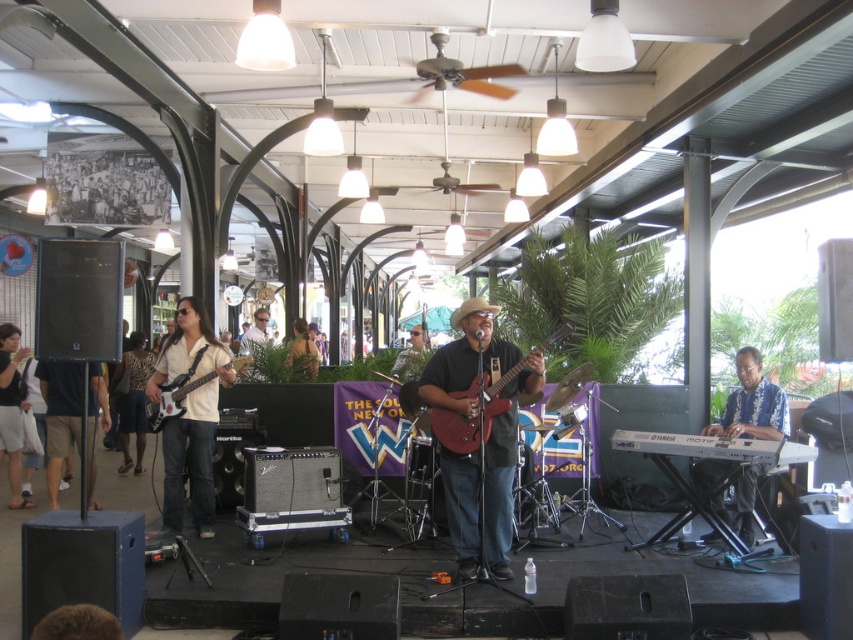
Question: Is hawaiian shirt at right wider than matte red electric guitar at center?

Choices:
 (A) yes
 (B) no

Answer: (B)

Question: Which of the following is the farthest from the observer?

Choices:
 (A) matte white shirt at left
 (B) matte red guitar at center
 (C) smooth brown guitar at center

Answer: (C)

Question: Which point is farther to the camera?

Choices:
 (A) (196, 355)
 (B) (529, 376)
 (C) (67, 410)
 (D) (136, 474)

Answer: (D)

Question: Which object appears closest to the camera in this image?

Choices:
 (A) matte black electric guitar at left
 (B) khaki shorts at left

Answer: (A)

Question: Is hawaiian shirt at right wider than khaki shorts at left?

Choices:
 (A) no
 (B) yes

Answer: (A)

Question: Can you confirm if white cotton shirt at left is positioned above matte black electric guitar at left?

Choices:
 (A) no
 (B) yes

Answer: (A)